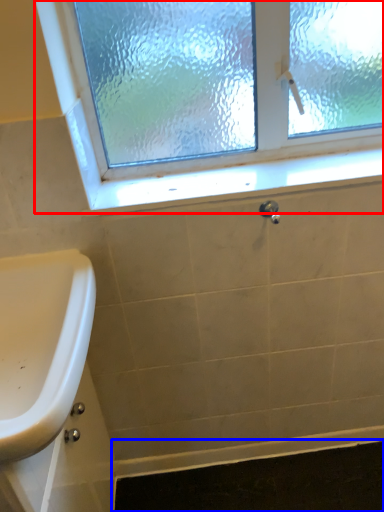
Question: Which object appears closest to the camera in this image, window (highlighted by a red box) or bath mat (highlighted by a blue box)?

Choices:
 (A) window
 (B) bath mat

Answer: (A)